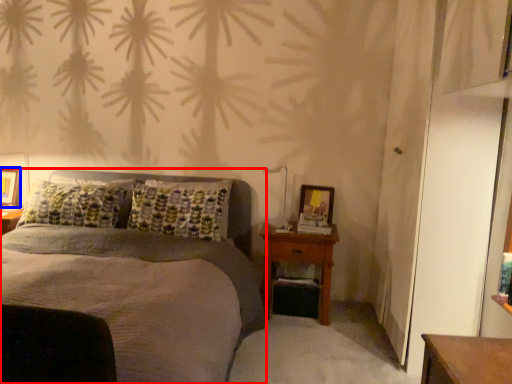
Question: Which point is further to the camera, bed (highlighted by a red box) or picture frame (highlighted by a blue box)?

Choices:
 (A) bed
 (B) picture frame

Answer: (B)